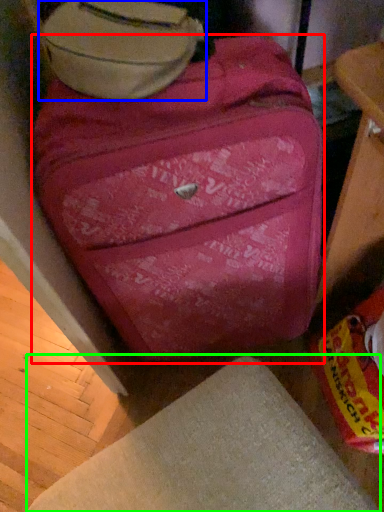
Question: Considering the real-world distances, which object is farthest from suitcase (highlighted by a red box)? luggage (highlighted by a blue box) or furniture (highlighted by a green box)?

Choices:
 (A) luggage
 (B) furniture

Answer: (B)